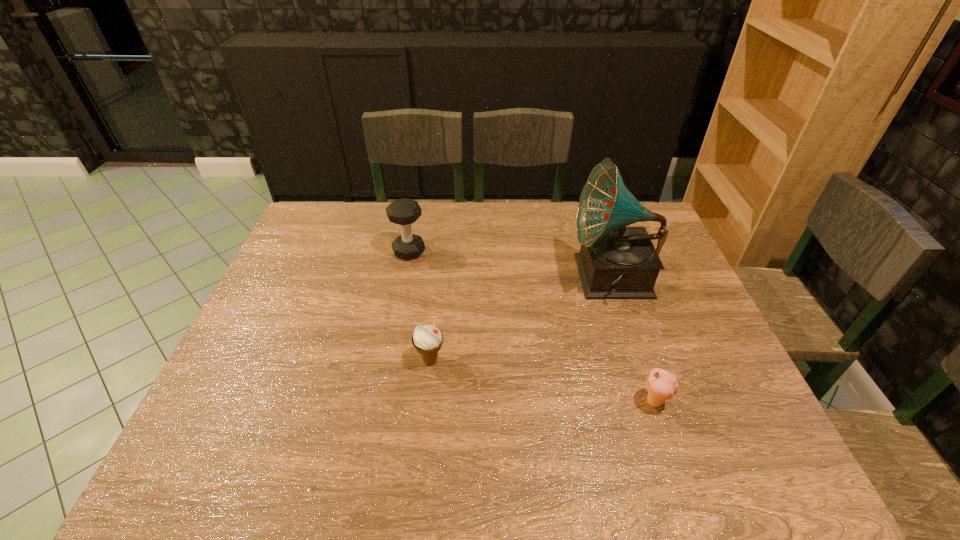
Locate an element on the screen. vacant space at the near left corner of the desktop is located at coordinates (227, 461).

At what (x,y) coordinates should I click in order to perform the action: click on vacant area that lies between the left icecream and the nearer icecream. Please return your answer as a coordinate pair (x, y). Looking at the image, I should click on (542, 381).

Locate an element on the screen. empty space between the farther icecream and the dumbbell is located at coordinates (420, 306).

You are a GUI agent. You are given a task and a screenshot of the screen. Output one action in this format:
    pyautogui.click(x=<x>, y=<y>)
    Task: Click on the free spot between the nearer icecream and the leftmost object
    
    Given the screenshot: What is the action you would take?
    pyautogui.click(x=532, y=327)

I want to click on unoccupied position between the nearest object and the tallest object, so click(633, 341).

This screenshot has width=960, height=540. I want to click on free point between the nearer icecream and the tallest object, so tap(633, 341).

This screenshot has height=540, width=960. I want to click on empty space that is in between the second tallest object and the record player, so click(511, 265).

Locate an element on the screen. The image size is (960, 540). free spot between the farther icecream and the nearest object is located at coordinates (542, 381).

The width and height of the screenshot is (960, 540). I want to click on free spot between the nearer icecream and the dumbbell, so click(x=532, y=327).

Find the location of a particular element. unoccupied position between the third shortest object and the farther icecream is located at coordinates (420, 306).